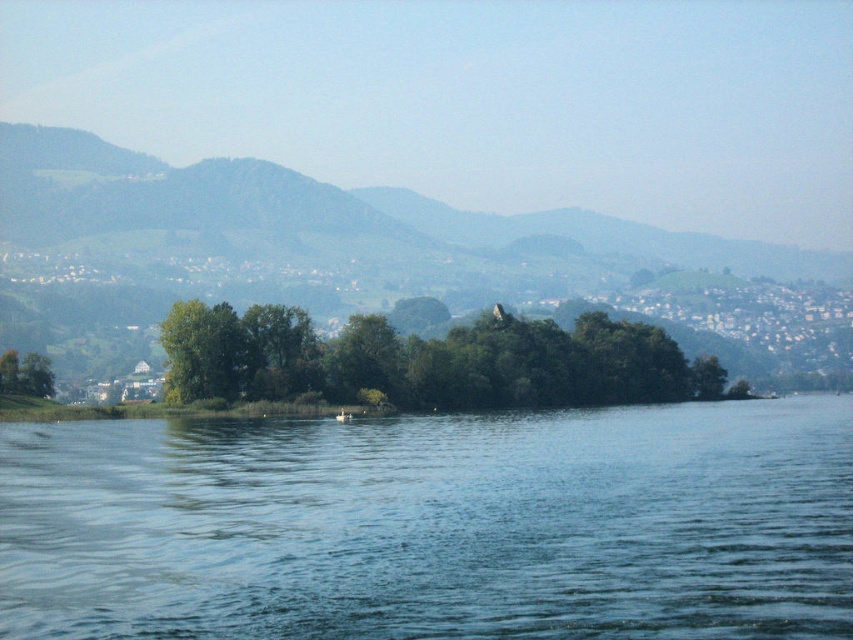
Is green leafy trees at center to the right of white plastic boat at center from the viewer's perspective?

Correct, you'll find green leafy trees at center to the right of white plastic boat at center.

Who is positioned more to the left, green leafy trees at center or white plastic boat at center?

Positioned to the left is white plastic boat at center.

Is point (236, 388) in front of point (341, 413)?

No, it is behind (341, 413).

Identify the location of green leafy trees at center. Image resolution: width=853 pixels, height=640 pixels. (427, 360).

Is green matte tree at lower left shorter than white plastic boat at center?

Incorrect, green matte tree at lower left's height does not fall short of white plastic boat at center's.

Where is `green matte tree at lower left`? This screenshot has width=853, height=640. green matte tree at lower left is located at coordinates (25, 374).

Does green leafy trees at center have a smaller size compared to green matte tree at lower left?

No, green leafy trees at center is not smaller than green matte tree at lower left.

Is point (270, 323) closer to viewer compared to point (18, 362)?

No.

At what (x,y) coordinates should I click in order to perform the action: click on green leafy trees at center. Please return your answer as a coordinate pair (x, y). The width and height of the screenshot is (853, 640). Looking at the image, I should click on (427, 360).